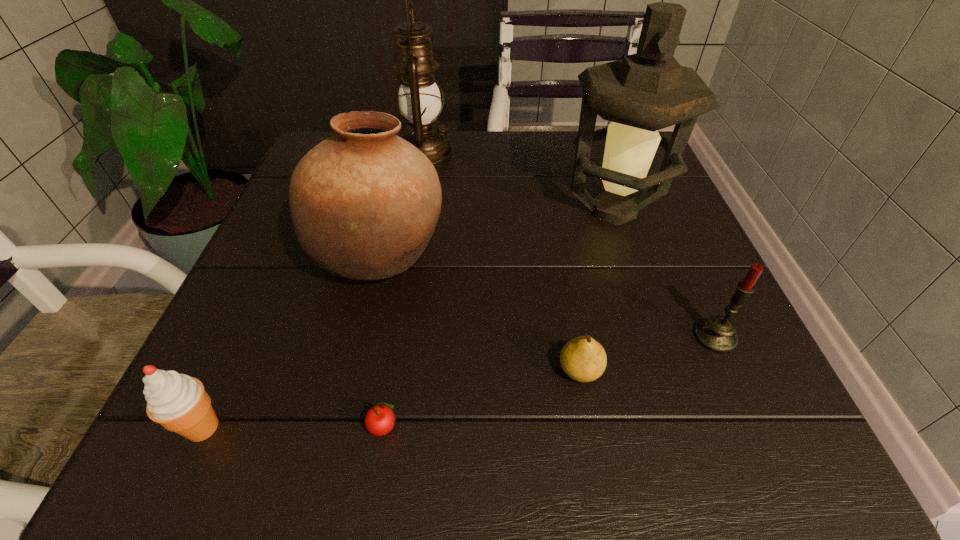
Locate an element on the screen. The height and width of the screenshot is (540, 960). vacant space that satisfies the following two spatial constraints: 1. on the back side of the right oil lamp; 2. on the right side of the icecream is located at coordinates (301, 211).

Find the location of `free spot that satisfies the following two spatial constraints: 1. on the front side of the cherry; 2. on the left side of the icecream`. free spot that satisfies the following two spatial constraints: 1. on the front side of the cherry; 2. on the left side of the icecream is located at coordinates (203, 428).

Image resolution: width=960 pixels, height=540 pixels. I want to click on vacant space that satisfies the following two spatial constraints: 1. on the back side of the leftmost object; 2. on the right side of the pear, so 228,370.

Where is `free space that satisfies the following two spatial constraints: 1. on the back side of the pear; 2. on the left side of the cherry`? Image resolution: width=960 pixels, height=540 pixels. free space that satisfies the following two spatial constraints: 1. on the back side of the pear; 2. on the left side of the cherry is located at coordinates (395, 370).

Where is `free region that satisfies the following two spatial constraints: 1. on the back side of the farthest object; 2. on the right side of the icecream`? The image size is (960, 540). free region that satisfies the following two spatial constraints: 1. on the back side of the farthest object; 2. on the right side of the icecream is located at coordinates (329, 151).